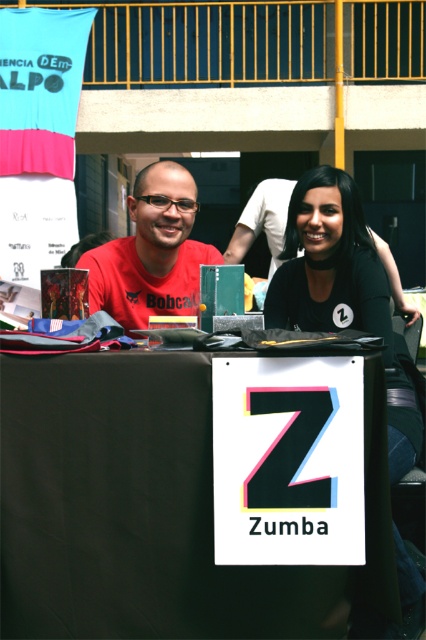
Does black matte shirt at center come in front of matte red t-shirt at center?

Yes, it is in front of matte red t-shirt at center.

Does point (391, 323) come behind point (138, 260)?

No, it is in front of (138, 260).

I want to click on black matte shirt at center, so click(345, 294).

Between black fabric table at center and matte red t-shirt at center, which one is positioned lower?

black fabric table at center is below.

Is point (256, 538) positioned in front of point (176, 305)?

That is True.

Who is more forward, (178,464) or (216,260)?

Point (178,464) is in front.

Locate an element on the screen. black fabric table at center is located at coordinates (186, 499).

Can you confirm if black fabric table at center is smaller than black matte shirt at center?

Yes.

Locate an element on the screen. black fabric table at center is located at coordinates (186, 499).

You are a GUI agent. You are given a task and a screenshot of the screen. Output one action in this format:
    pyautogui.click(x=<x>, y=<y>)
    Task: Click on the black fabric table at center
    Image resolution: width=426 pixels, height=640 pixels.
    Given the screenshot: What is the action you would take?
    pyautogui.click(x=186, y=499)